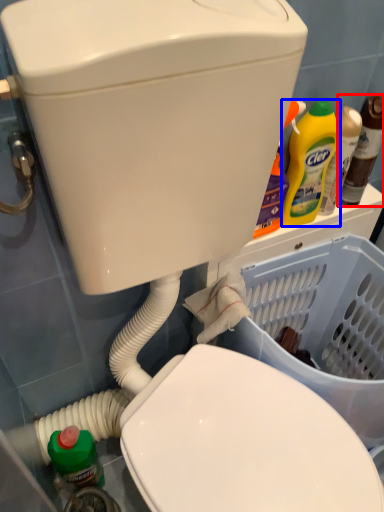
Question: Which object appears farthest to the camera in this image, bottle (highlighted by a red box) or cleaning product (highlighted by a blue box)?

Choices:
 (A) bottle
 (B) cleaning product

Answer: (A)